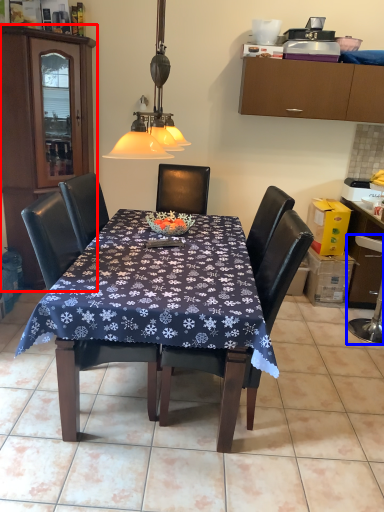
Question: Which object appears farthest to the camera in this image, cabinetry (highlighted by a red box) or swivel chair (highlighted by a blue box)?

Choices:
 (A) cabinetry
 (B) swivel chair

Answer: (B)